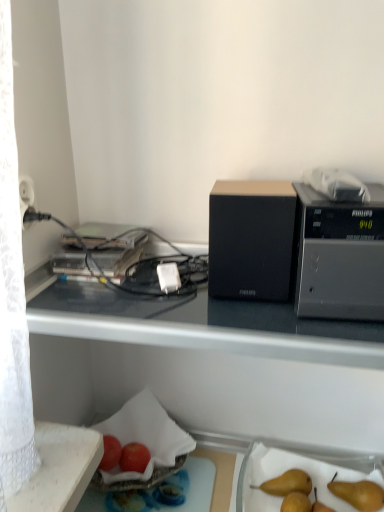
You are a GUI agent. You are given a task and a screenshot of the screen. Output one action in this format:
    pyautogui.click(x=<x>, y=<y>)
    Task: Click on the vacant area that is situated to the right of red matte apple at lower center, placed as the 2th apple when sorted from left to right
    
    Given the screenshot: What is the action you would take?
    pyautogui.click(x=188, y=480)